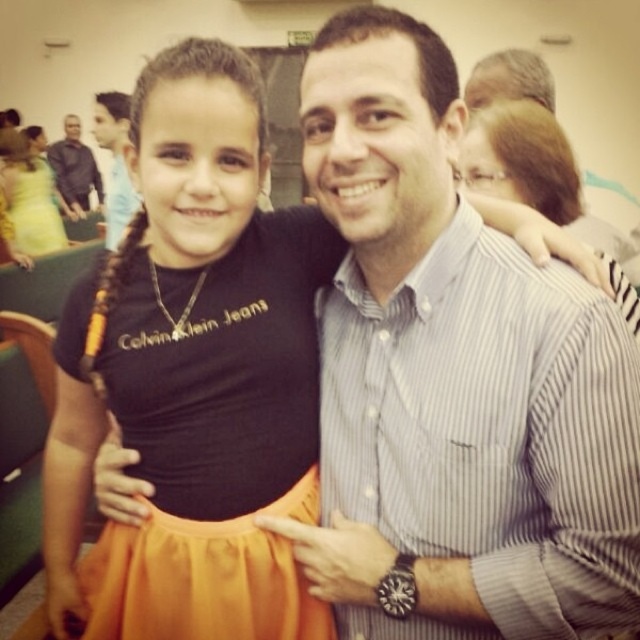
Question: Is the position of orange satin dress at center less distant than that of orange satin dress at left?

Choices:
 (A) yes
 (B) no

Answer: (A)

Question: Can you confirm if striped shirt at upper right is positioned below orange fabric pigtail at upper left?

Choices:
 (A) yes
 (B) no

Answer: (B)

Question: Which point is farther to the camera?

Choices:
 (A) matte black shirt at upper center
 (B) black shirt at upper left
 (C) orange fabric pigtail at upper left
 (D) orange satin dress at center

Answer: (B)

Question: Estimate the real-world distances between objects in this image. Which object is farther from the matte black shirt at upper center?

Choices:
 (A) striped cotton shirt at center
 (B) striped shirt at upper right

Answer: (A)

Question: Is matte black shirt at upper center bigger than black shirt at upper left?

Choices:
 (A) yes
 (B) no

Answer: (A)

Question: Which object is positioned farthest from the black shirt at upper left?

Choices:
 (A) orange satin dress at left
 (B) striped shirt at upper right

Answer: (B)